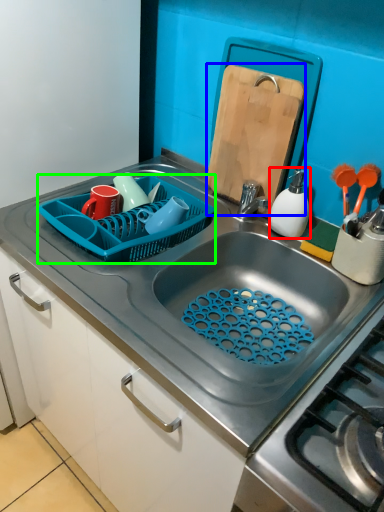
Question: Considering the real-world distances, which object is farthest from appliance (highlighted by a red box)? cutting board (highlighted by a blue box) or basket (highlighted by a green box)?

Choices:
 (A) cutting board
 (B) basket

Answer: (B)